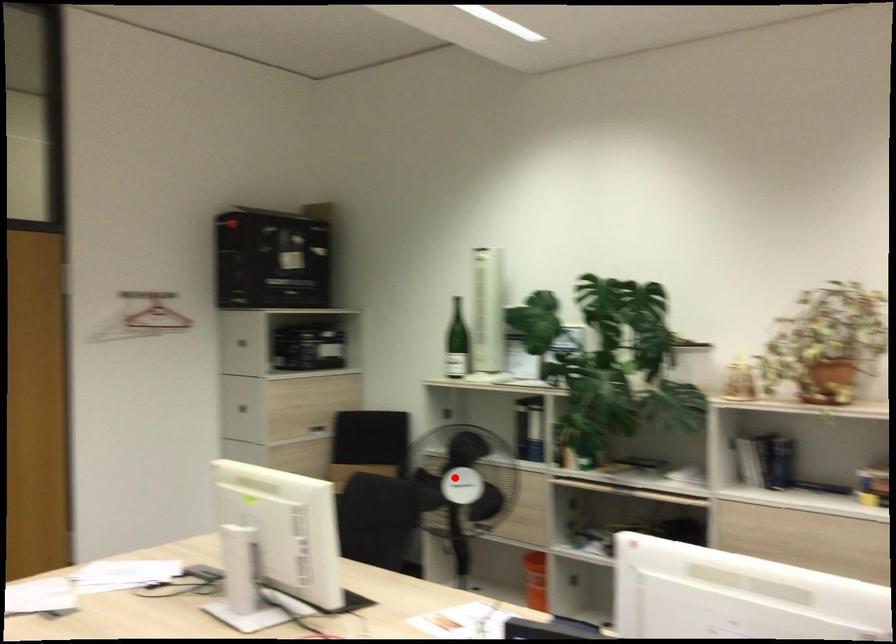
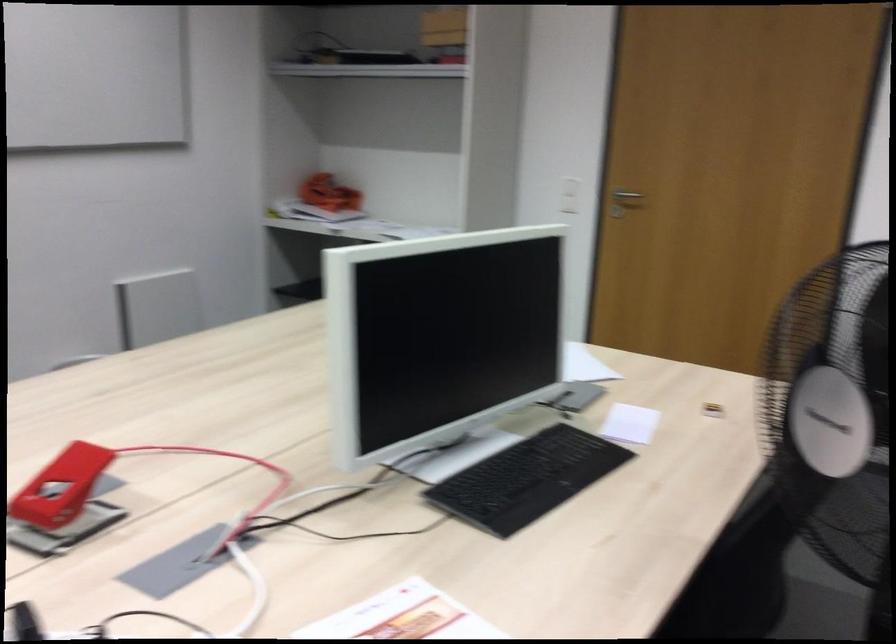
Question: I am providing you with two images of the same scene from different viewpoints. Given a red point in image1, look at the same physical point in image2. Is it:

Choices:
 (A) Closer to the viewpoint
 (B) Farther from the viewpoint

Answer: (A)